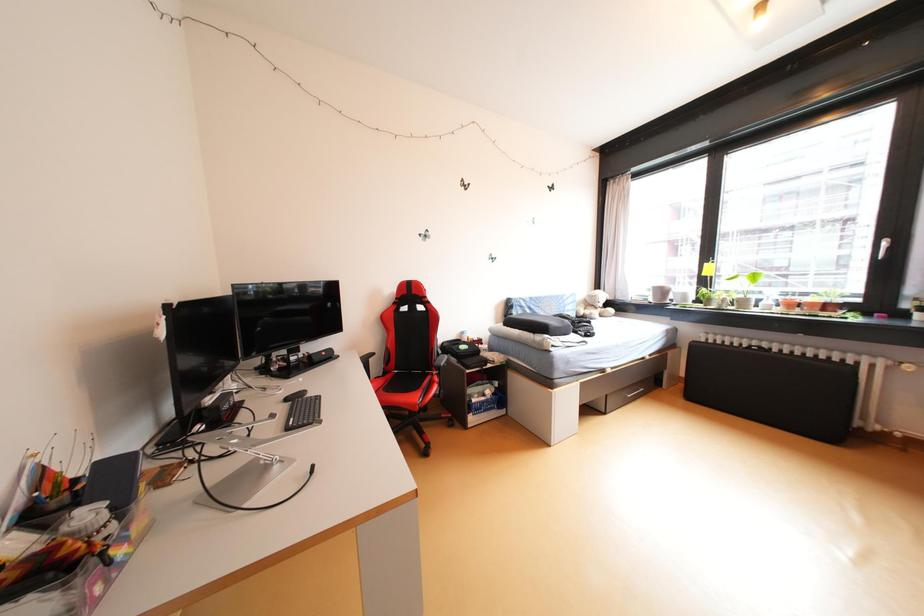
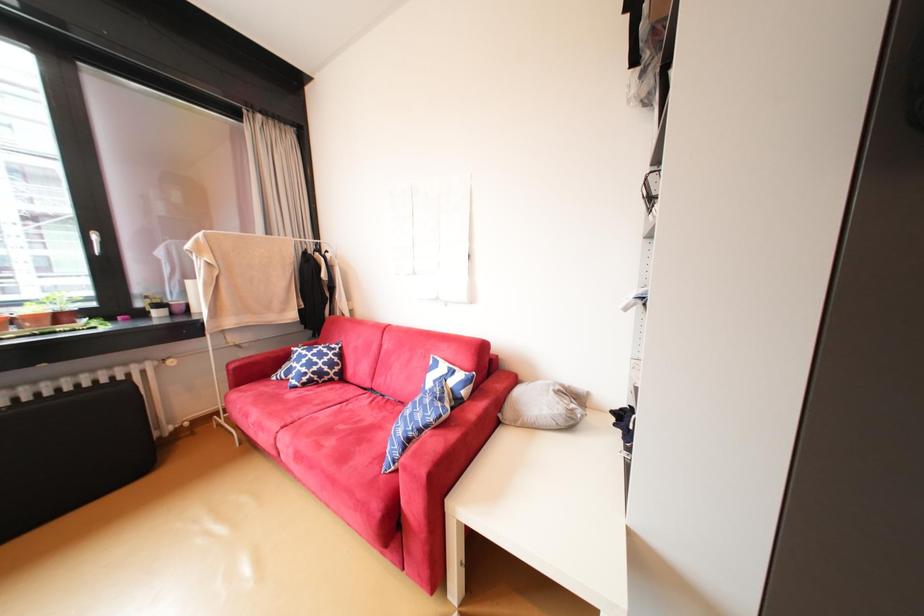
Question: How did the camera likely rotate?

Choices:
 (A) Left
 (B) Right
 (C) Up
 (D) Down

Answer: (B)